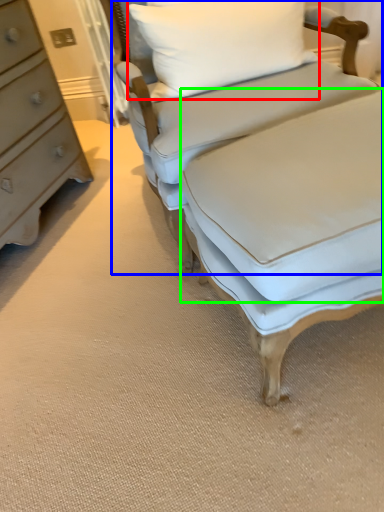
Question: Based on their relative distances, which object is nearer to pillow (highlighted by a red box)? Choose from studio couch (highlighted by a blue box) and sheet (highlighted by a green box).

Choices:
 (A) studio couch
 (B) sheet

Answer: (A)